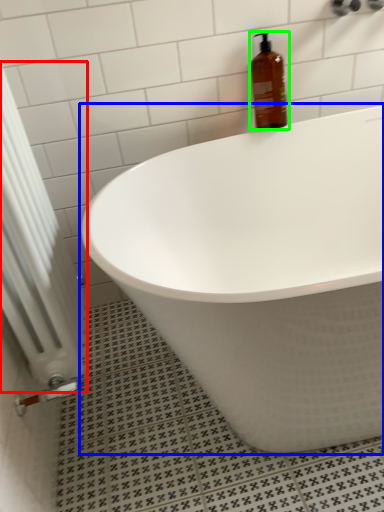
Question: Which object is the farthest from radiator (highlighted by a red box)? Choose among these: bathtub (highlighted by a blue box) or bottle (highlighted by a green box).

Choices:
 (A) bathtub
 (B) bottle

Answer: (B)